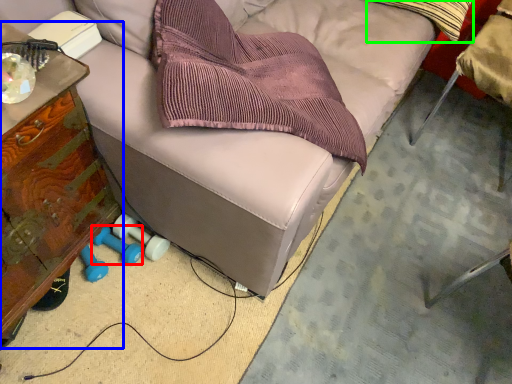
Question: Estimate the real-world distances between objects in this image. Which object is farther from dumbbell (highlighted by a red box), furniture (highlighted by a blue box) or throw pillow (highlighted by a green box)?

Choices:
 (A) furniture
 (B) throw pillow

Answer: (B)